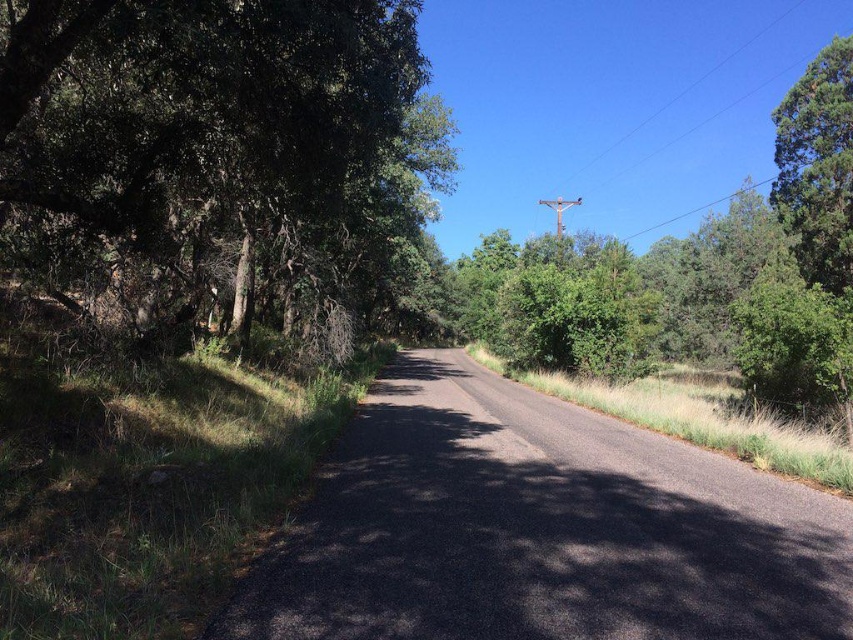
Question: Is green leafy tree at left closer to the viewer compared to green leafy tree at center?

Choices:
 (A) no
 (B) yes

Answer: (B)

Question: Does green textured tree at right come behind metallic gray telegraph pole at center?

Choices:
 (A) no
 (B) yes

Answer: (A)

Question: Which of the following is the closest to the observer?

Choices:
 (A) (811, 108)
 (B) (567, 198)
 (C) (22, 216)
 (D) (337, 602)

Answer: (D)

Question: Which object is positioned closest to the green leafy tree at center?

Choices:
 (A) metallic wire at upper center
 (B) green textured tree at right
 (C) metallic gray telegraph pole at center

Answer: (C)

Question: Which object is the farthest from the black asphalt road at center?

Choices:
 (A) green leafy tree at left
 (B) green textured tree at right
 (C) metallic wire at upper center

Answer: (C)

Question: Can you confirm if green leafy tree at left is smaller than metallic gray telegraph pole at center?

Choices:
 (A) yes
 (B) no

Answer: (A)